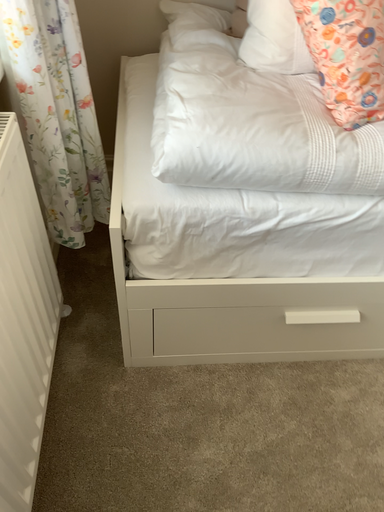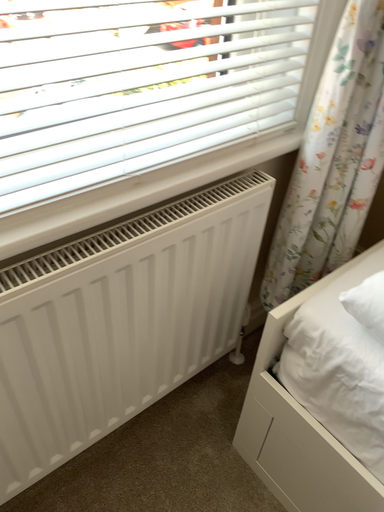
Question: Which way did the camera rotate in the video?

Choices:
 (A) rotated upward
 (B) rotated downward

Answer: (A)